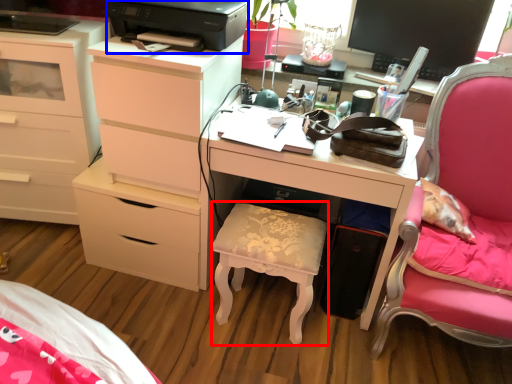
Question: Which of the following is the farthest to the observer, stool (highlighted by a red box) or printer (highlighted by a blue box)?

Choices:
 (A) stool
 (B) printer

Answer: (A)